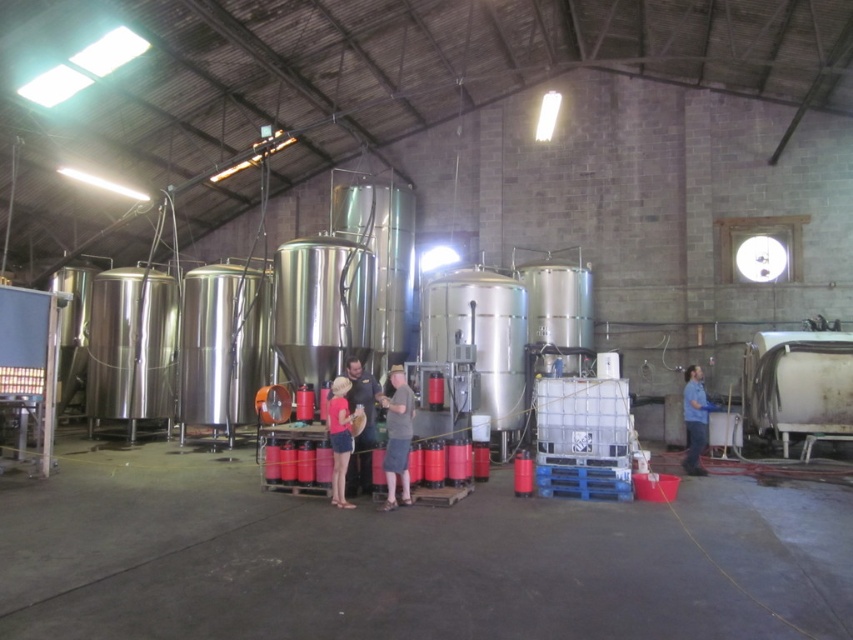
You are an event planner setting up a photo shoot in this industrial space. You need to position a camera on a tripod that requires a minimum height of 6 feet to capture both the matte red shirt at center and the blue fabric shirt at right clearly. Given their heights, will the camera need to be raised or lowered from its default position of 5.5 feet?

The matte red shirt at center is shorter than the blue fabric shirt at right. Since the camera needs to capture both and requires a minimum height of 6 feet, the camera should be raised from its default 5.5 feet to ensure both individuals are in frame.

You are a tour guide in the brewery. You need to ensure that visitors maintain a minimum distance of 5 meters between each other for safety. Are the matte red shirt at center and blue fabric shirt at right following this rule?

The matte red shirt at center is 5.60 meters away from the blue fabric shirt at right. Since the required minimum distance is 5 meters, they are following the safety rule as they are slightly over the required distance.